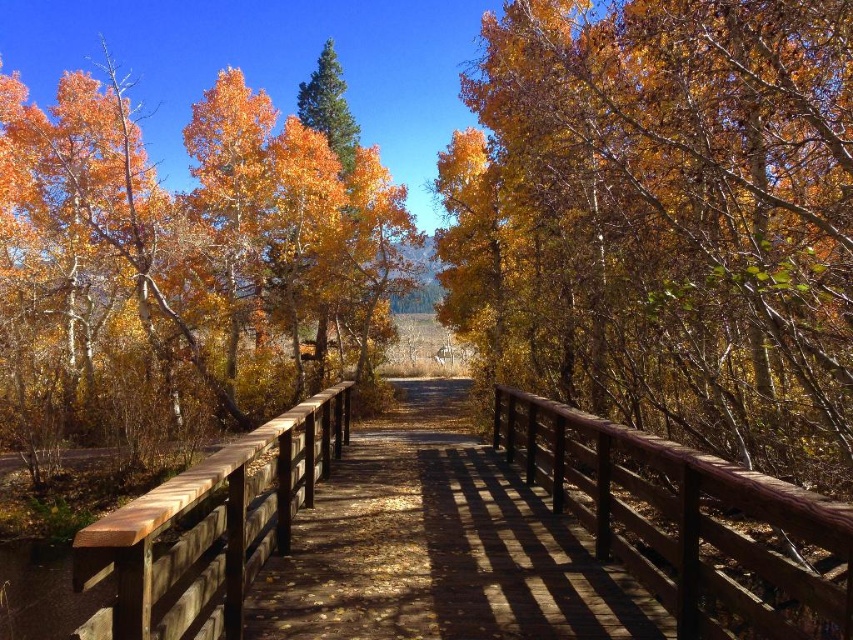
You are planning to cross the wooden bridge at center while carrying a large backpack. The brown wooden rail at center is available for support. Considering their widths, which object would provide a more stable base for your footing?

The wooden bridge at center is wider than the brown wooden rail at center, so it would provide a more stable base for your footing.